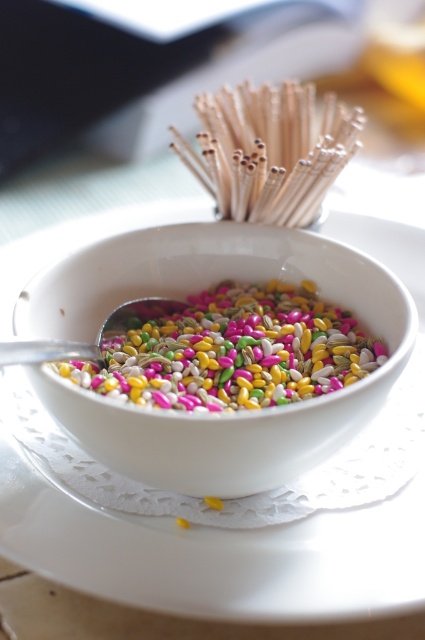
In the scene shown: You are arranging a centerpiece for a party and need to place the white glossy bowl at center and the multicolored coated seeds at center. According to the image, which object should be placed to the left to ensure proper alignment?

The white glossy bowl at center should be placed to the left of the multicolored coated seeds at center because the white glossy bowl at center is positioned on the left side of multicolored coated seeds at center in the image.

You are holding a camera and want to take a closeup photo of the white glossy bowl at center. The camera requires the subject to be at least 20 inches away to focus properly. Can you take the photo without moving the bowl?

The distance between the white glossy bowl at center and the camera is 24.08 inches, which is more than the required 20 inches. Therefore, you can take the photo without moving the bowl.